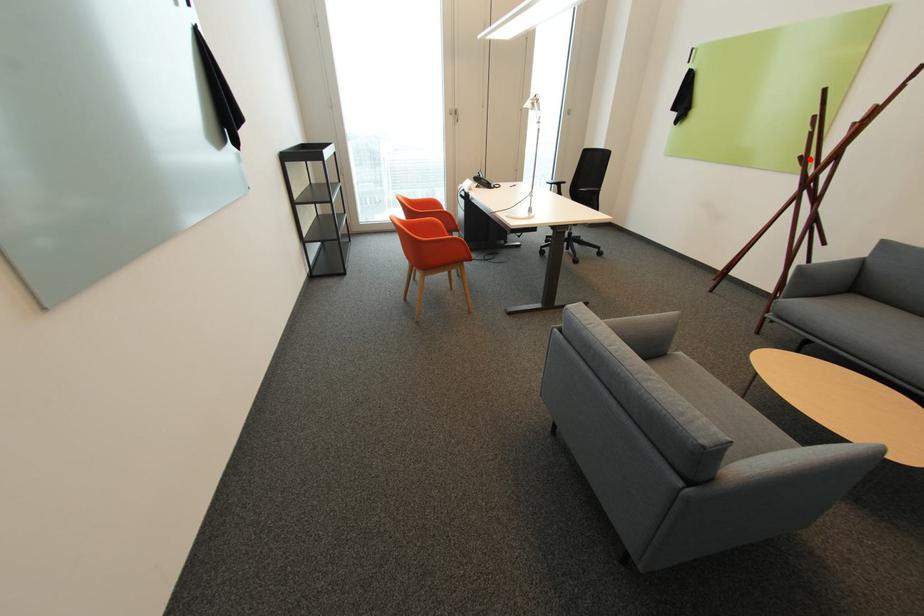
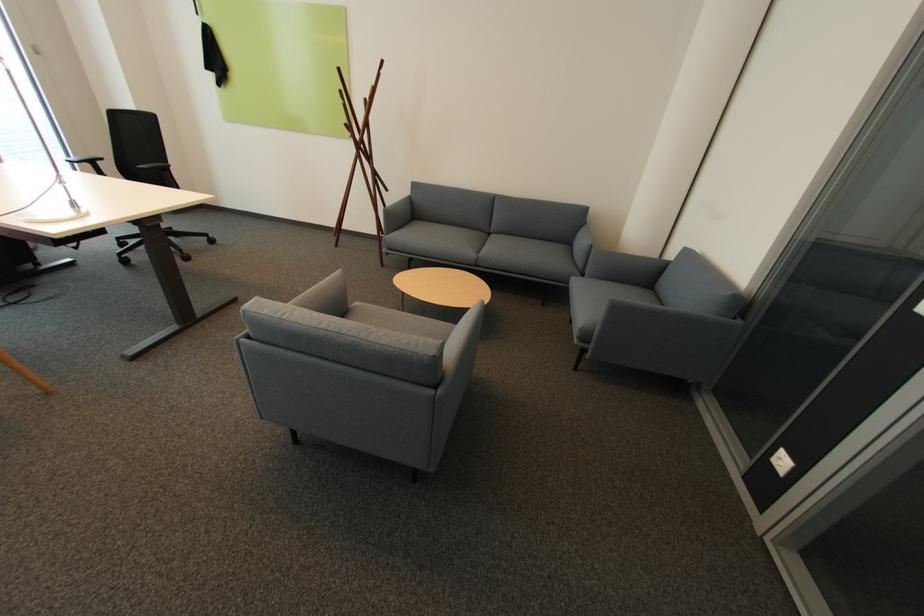
Locate, in the second image, the point that corresponds to the highlighted location in the first image.

(355, 126)